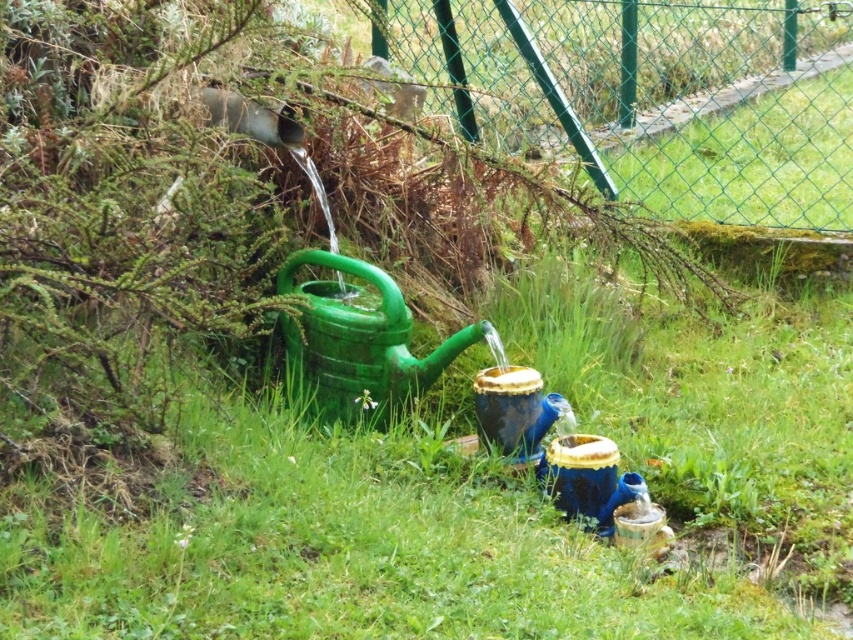
Who is more forward, (x=399, y=358) or (x=602, y=488)?

Positioned in front is point (x=602, y=488).

Which is behind, point (357, 314) or point (582, 433)?

The point (582, 433) is more distant.

Measure the distance between green plastic watering can at center and camera.

green plastic watering can at center and camera are 2.30 meters apart from each other.

Where is `green plastic watering can at center`? The image size is (853, 640). green plastic watering can at center is located at coordinates (357, 342).